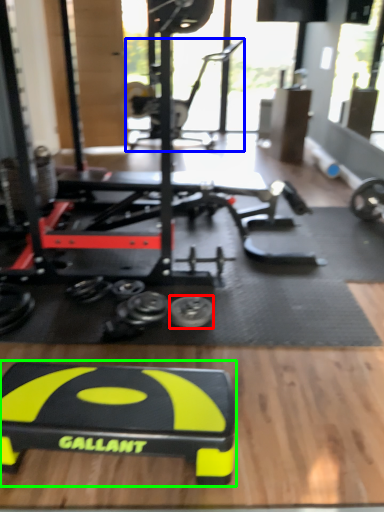
Question: Which is farther away from tire (highlighted by a red box)? sport equipment (highlighted by a blue box) or sport equipment (highlighted by a green box)?

Choices:
 (A) sport equipment
 (B) sport equipment

Answer: (A)